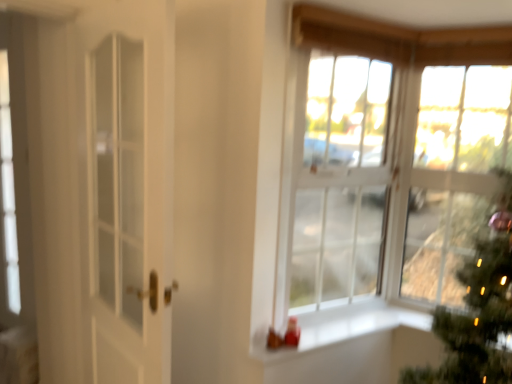
Question: Are white glass window at center, the 2th window when ordered from front to back, and white smooth window sill at center beside each other?

Choices:
 (A) no
 (B) yes

Answer: (A)

Question: Is white glass window at center, the 2th window when ordered from front to back, taller than white smooth window sill at center?

Choices:
 (A) yes
 (B) no

Answer: (A)

Question: From the image's perspective, is white glass window at center, which appears as the 2th window when viewed from the back, on white smooth window sill at center?

Choices:
 (A) no
 (B) yes

Answer: (B)

Question: Does white glass window at center, which appears as the 2th window when viewed from the back, lie behind white smooth window sill at center?

Choices:
 (A) yes
 (B) no

Answer: (A)

Question: From a real-world perspective, is white glass window at center, the 2th window when ordered from front to back, located higher than white smooth window sill at center?

Choices:
 (A) no
 (B) yes

Answer: (B)

Question: In terms of size, does clear glass window at upper right, which is the 3th window from back to front, appear bigger or smaller than clear glass window at upper right, arranged as the 3th window when viewed from the front?

Choices:
 (A) small
 (B) big

Answer: (B)

Question: Does point (410, 125) appear closer or farther from the camera than point (448, 253)?

Choices:
 (A) farther
 (B) closer

Answer: (A)

Question: Is clear glass window at upper right, which appears as the first window when viewed from the front, wider or thinner than clear glass window at upper right, the first window from the back?

Choices:
 (A) wide
 (B) thin

Answer: (A)

Question: Considering their positions, is clear glass window at upper right, which is the 3th window from back to front, located in front of or behind clear glass window at upper right, the first window from the back?

Choices:
 (A) behind
 (B) front

Answer: (B)

Question: Looking at their shapes, would you say white glass window at center, the 2th window when ordered from front to back, is wider or thinner than white smooth window sill at center?

Choices:
 (A) thin
 (B) wide

Answer: (A)

Question: From the image's perspective, relative to white smooth window sill at center, is white glass window at center, the 2th window when ordered from front to back, above or below?

Choices:
 (A) below
 (B) above

Answer: (B)

Question: Based on their sizes in the image, would you say white glass window at center, the 2th window when ordered from front to back, is bigger or smaller than white smooth window sill at center?

Choices:
 (A) big
 (B) small

Answer: (A)

Question: Is white glass window at center, the 2th window when ordered from front to back, to the left or to the right of white smooth window sill at center in the image?

Choices:
 (A) right
 (B) left

Answer: (A)

Question: Is point (309, 211) closer or farther from the camera than point (487, 175)?

Choices:
 (A) farther
 (B) closer

Answer: (B)

Question: From a real-world perspective, is white glass window at center, which appears as the 2th window when viewed from the back, physically located above or below clear glass window at upper right, arranged as the 3th window when viewed from the front?

Choices:
 (A) below
 (B) above

Answer: (B)